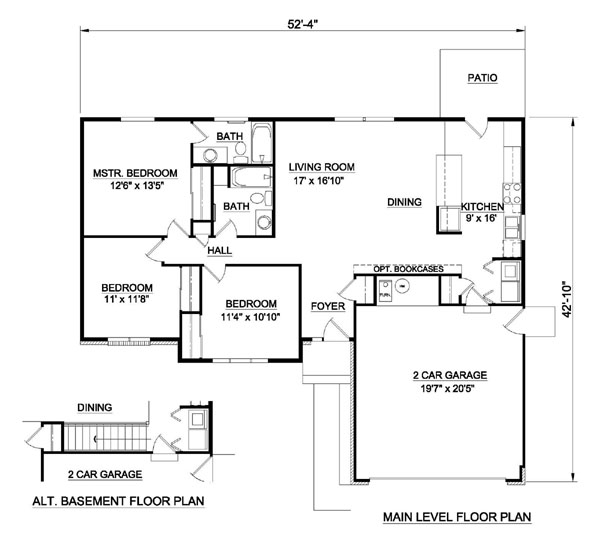
Image resolution: width=600 pixels, height=544 pixels. I want to click on stove, so click(x=516, y=193).